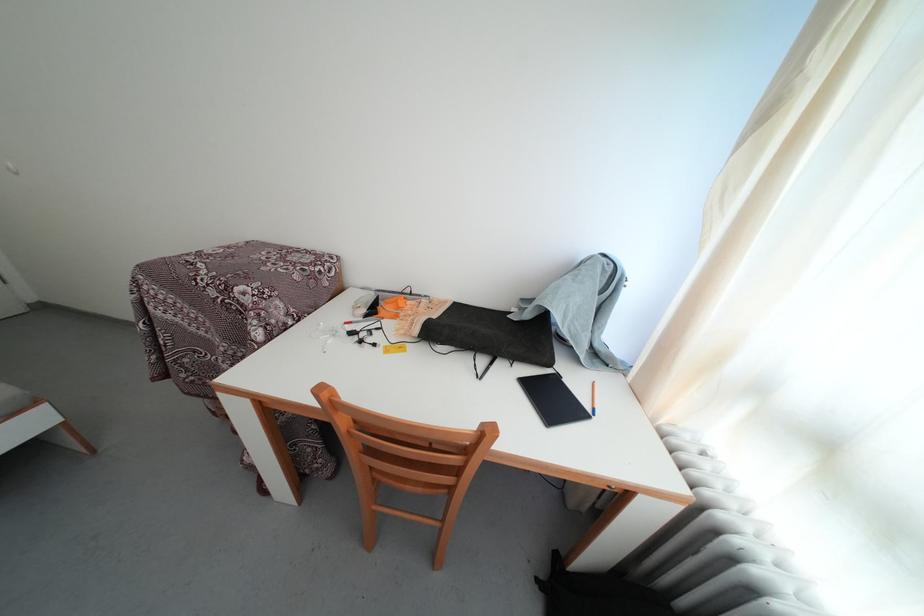
Where is `orange pencil`? orange pencil is located at coordinates (592, 399).